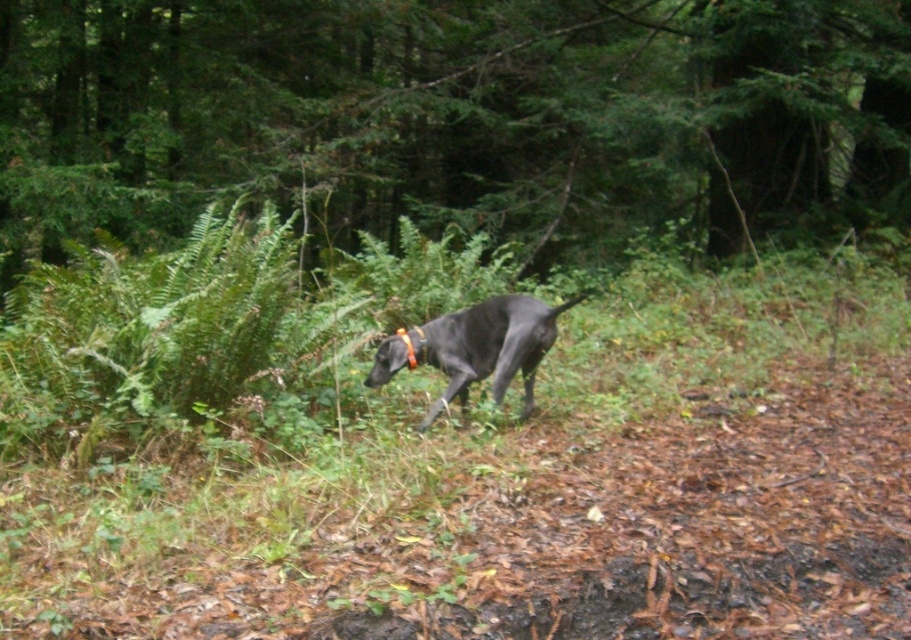
Question: In this image, where is green leafy tree at center located relative to shiny black dog at center?

Choices:
 (A) left
 (B) right

Answer: (B)

Question: Is green leafy tree at center further to camera compared to shiny black dog at center?

Choices:
 (A) yes
 (B) no

Answer: (A)

Question: Is green leafy tree at center thinner than shiny black dog at center?

Choices:
 (A) yes
 (B) no

Answer: (B)

Question: Among these points, which one is nearest to the camera?

Choices:
 (A) (490, 308)
 (B) (357, 20)

Answer: (A)

Question: Among these points, which one is farthest from the camera?

Choices:
 (A) (538, 300)
 (B) (712, 202)

Answer: (B)